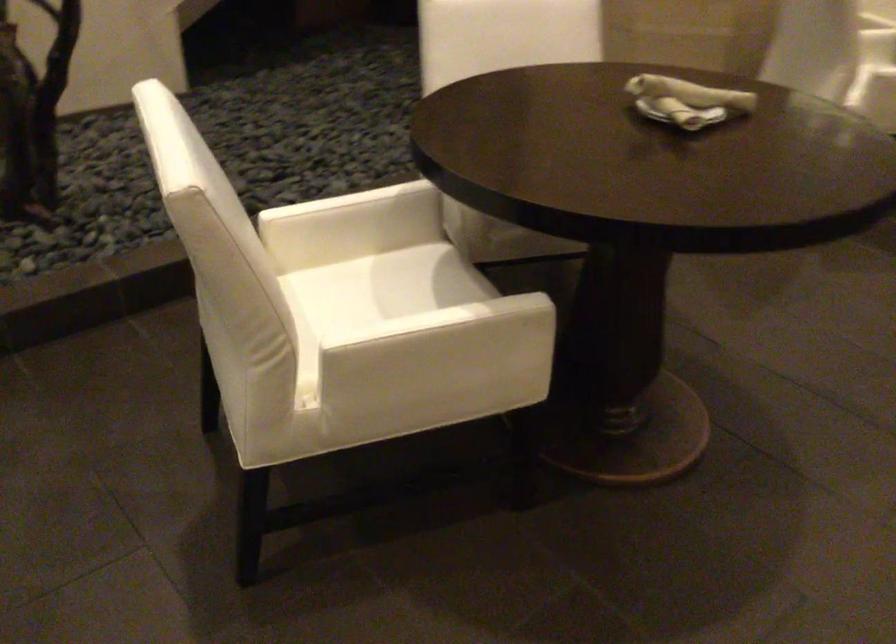
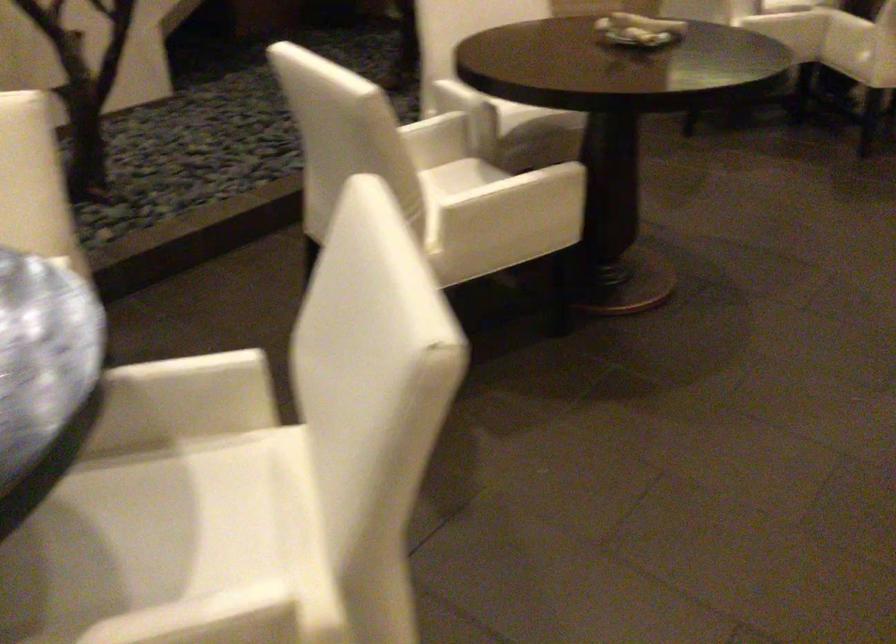
In the second image, find the point that corresponds to [402,274] in the first image.

(455, 176)